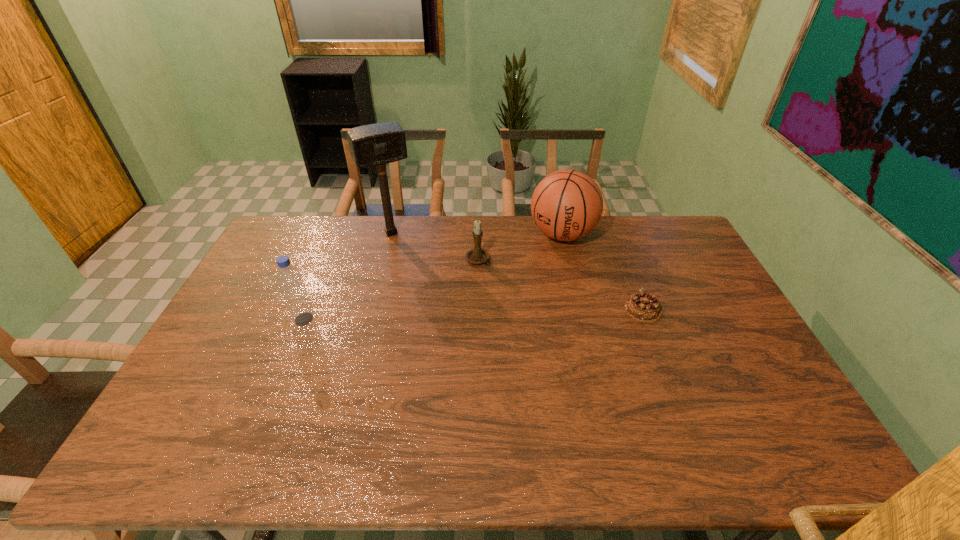
I want to click on unoccupied area between the second object from right to left and the third object from right to left, so click(519, 247).

Locate an element on the screen. Image resolution: width=960 pixels, height=540 pixels. blank region between the bottle and the chocolate cake is located at coordinates (474, 314).

Identify the location of free spot between the candle holder and the second object from right to left. The image size is (960, 540). (519, 247).

This screenshot has width=960, height=540. Find the location of `unoccupied position between the tallest object and the shortest object`. unoccupied position between the tallest object and the shortest object is located at coordinates (517, 271).

Identify the location of empty location between the chocolate cake and the basketball. (603, 272).

This screenshot has height=540, width=960. I want to click on free area in between the rightmost object and the leftmost object, so click(x=474, y=314).

The image size is (960, 540). I want to click on unoccupied position between the leftmost object and the fourth object from left to right, so click(x=433, y=277).

Image resolution: width=960 pixels, height=540 pixels. In order to click on object that can be found as the closest to the third object from right to left in this screenshot , I will do `click(566, 205)`.

Locate an element on the screen. object that is the third nearest to the fourth object from left to right is located at coordinates (377, 144).

Locate an element on the screen. free space that satisfies the following two spatial constraints: 1. on the front side of the fourth object from right to left; 2. on the right side of the rightmost object is located at coordinates (372, 309).